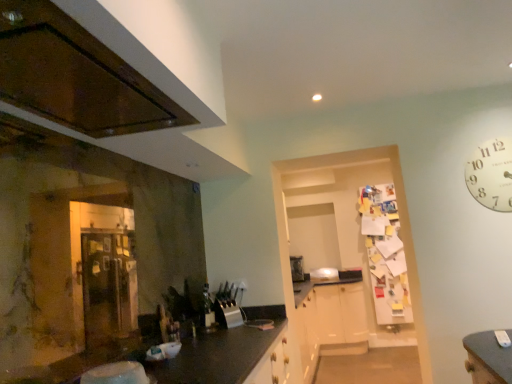
Question: Relative to white paper clock at upper right, is satin silver toaster at center in front or behind?

Choices:
 (A) front
 (B) behind

Answer: (B)

Question: From the image's perspective, is satin silver toaster at center above or below white paper clock at upper right?

Choices:
 (A) below
 (B) above

Answer: (A)

Question: Which object is the farthest from the glossy wood cabinetry at upper left?

Choices:
 (A) white paper clock at upper right
 (B) satin silver toaster at center

Answer: (B)

Question: Estimate the real-world distances between objects in this image. Which object is farther from the white paper clock at upper right?

Choices:
 (A) satin silver toaster at center
 (B) glossy wood cabinetry at upper left

Answer: (B)